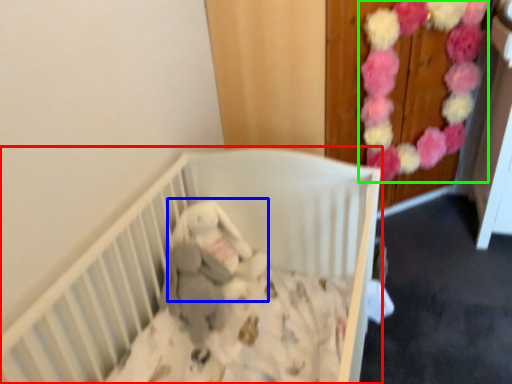
Question: Which object is positioned farthest from infant bed (highlighted by a red box)? Select from baby elephant (highlighted by a blue box) and flower (highlighted by a green box).

Choices:
 (A) baby elephant
 (B) flower

Answer: (B)